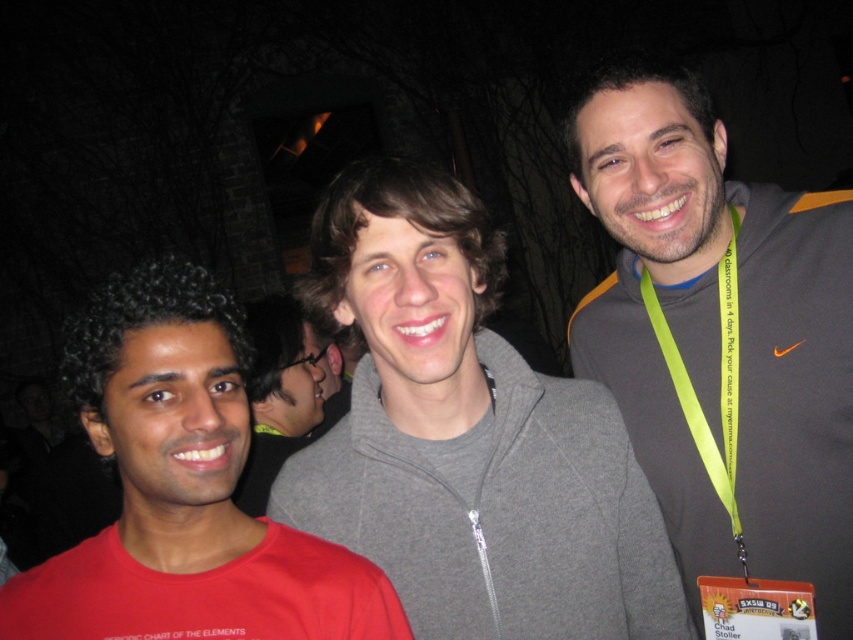
You are trying to decide which item to grab first from the scene. Based on their sizes, which object is wider, the gray fleece jacket at center or the matte red neck at center?

The gray fleece jacket at center is wider than the matte red neck at center according to the description.

In the image, there are three people standing outside at night. The person on the left is wearing a red tshirt, the middle person has a gray zip hoodie, and the one on the right has a dark gray hoodie with orange accents. Based on their positions, which person is located at the coordinate point (277,396)?

The point (277,396) indicates the gray hoodie at center, so the middle person with the gray zip hoodie is located at that coordinate.